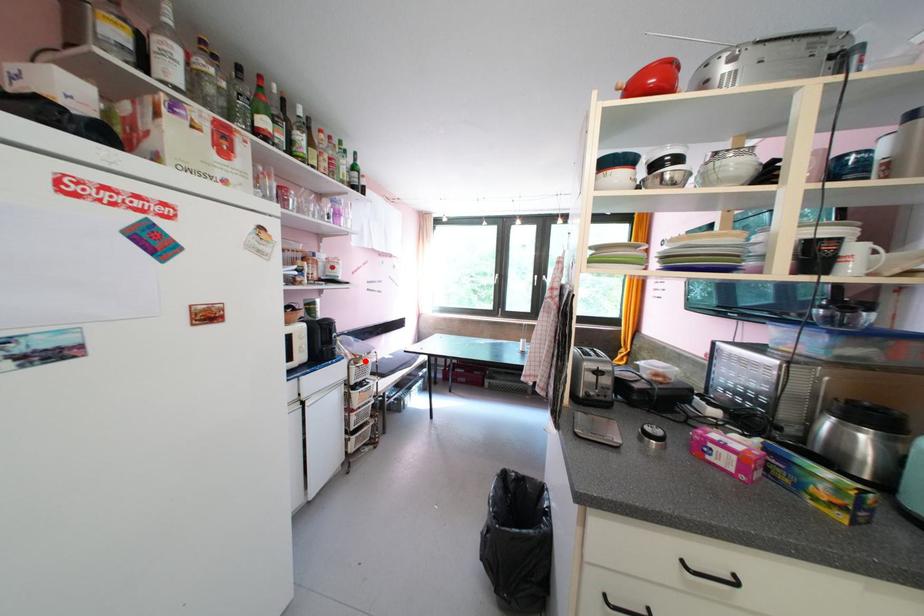
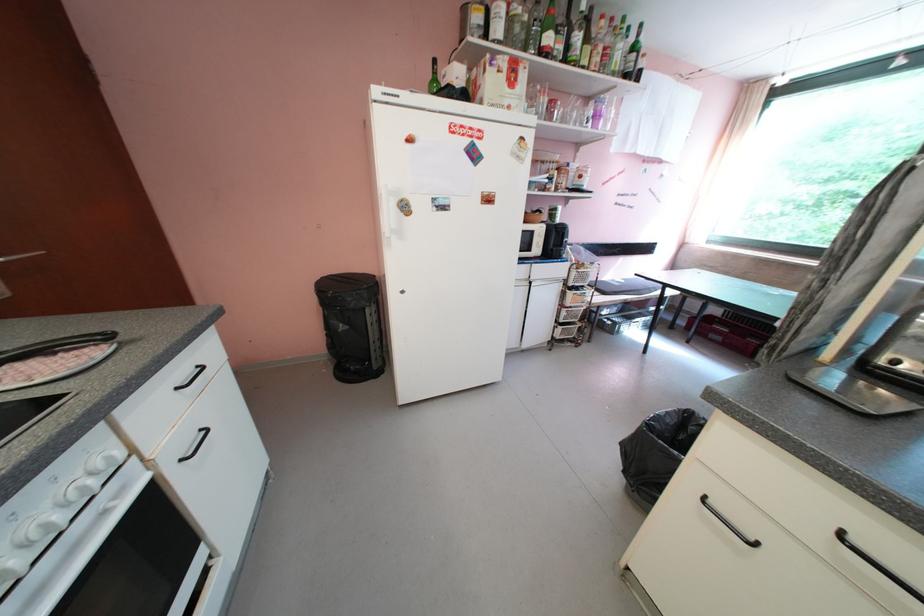
Find the pixel in the second image that matches the highlighted location in the first image.

(588, 268)